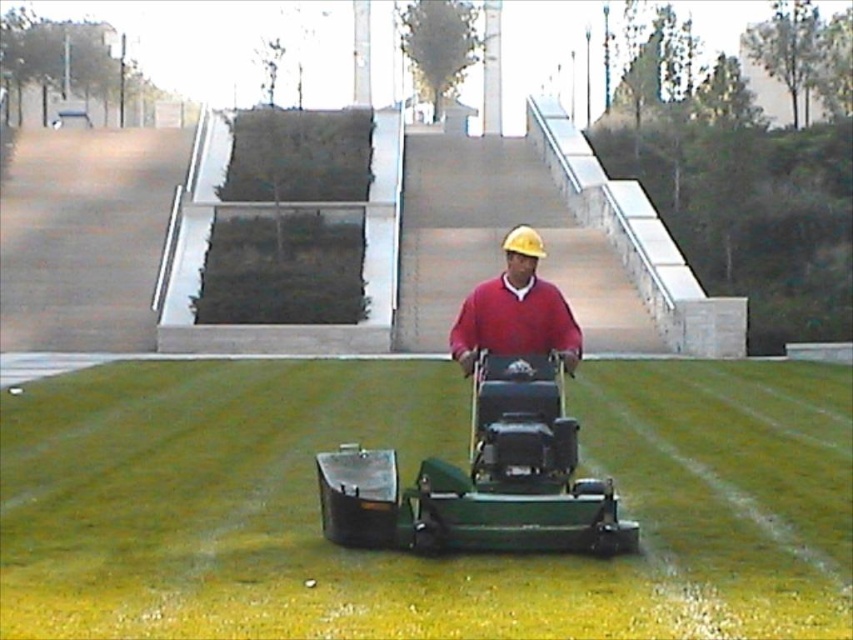
Does green grass at center have a greater height compared to matte red sweater at center?

Incorrect, green grass at center's height is not larger of matte red sweater at center's.

Is point (51, 620) closer to viewer compared to point (479, 310)?

Yes, it is in front of point (479, 310).

Where is `green grass at center`? The image size is (853, 640). green grass at center is located at coordinates 405,481.